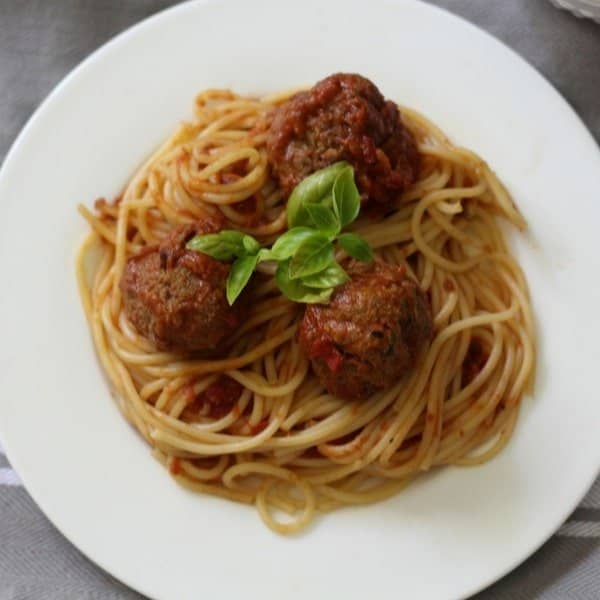
In order to click on gray and white tablecloth in this screenshot , I will do `click(588, 518)`, `click(569, 576)`, `click(69, 578)`, `click(19, 505)`.